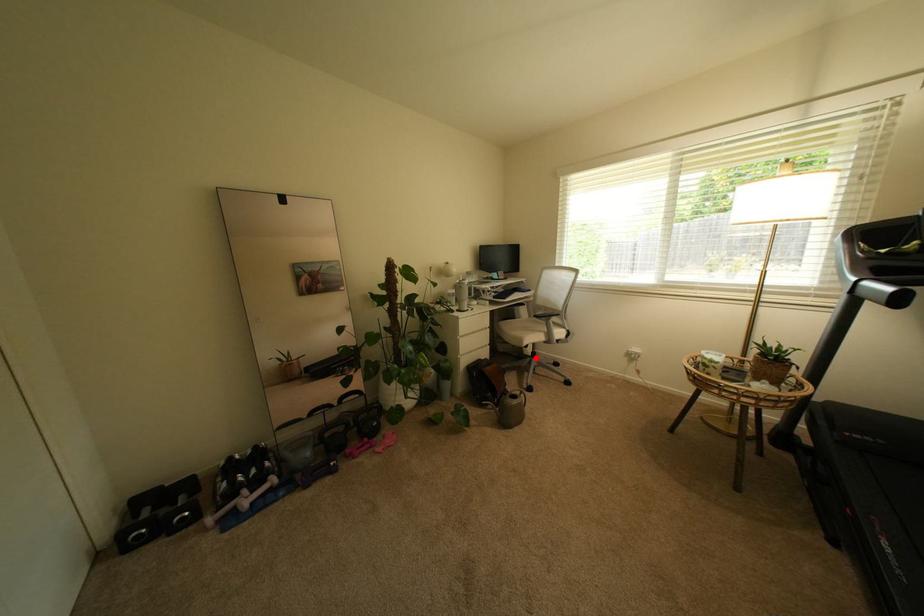
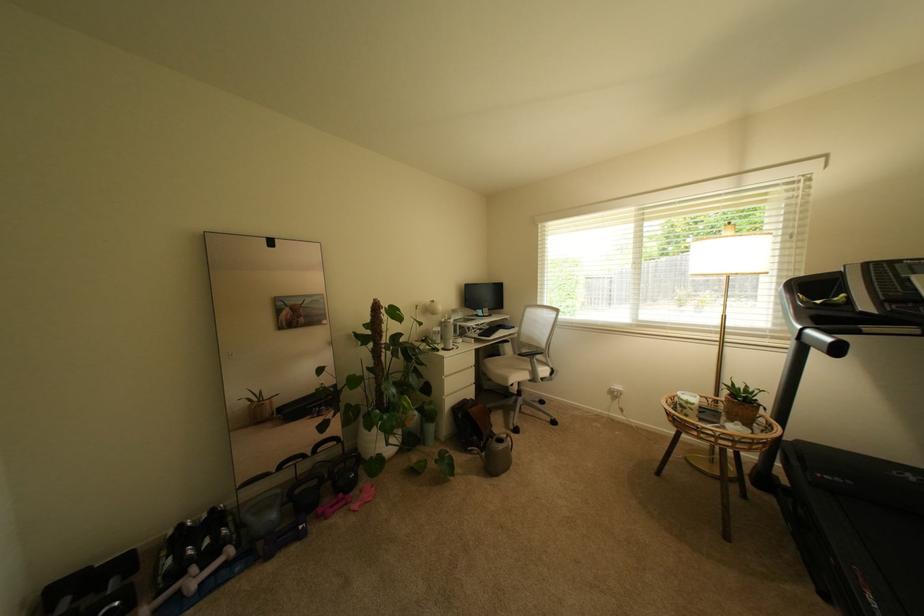
The point at the highlighted location is marked in the first image. Where is the corresponding point in the second image?

(521, 395)